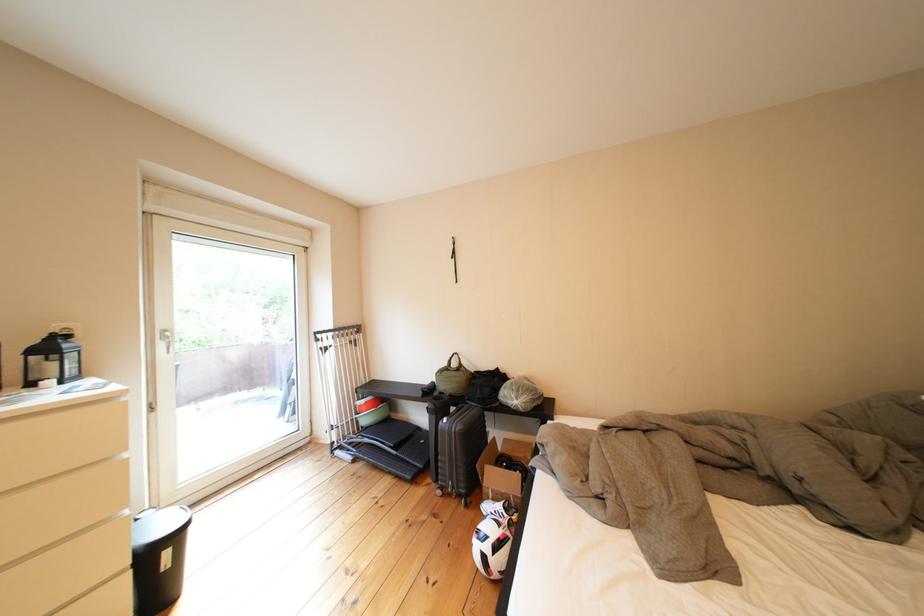
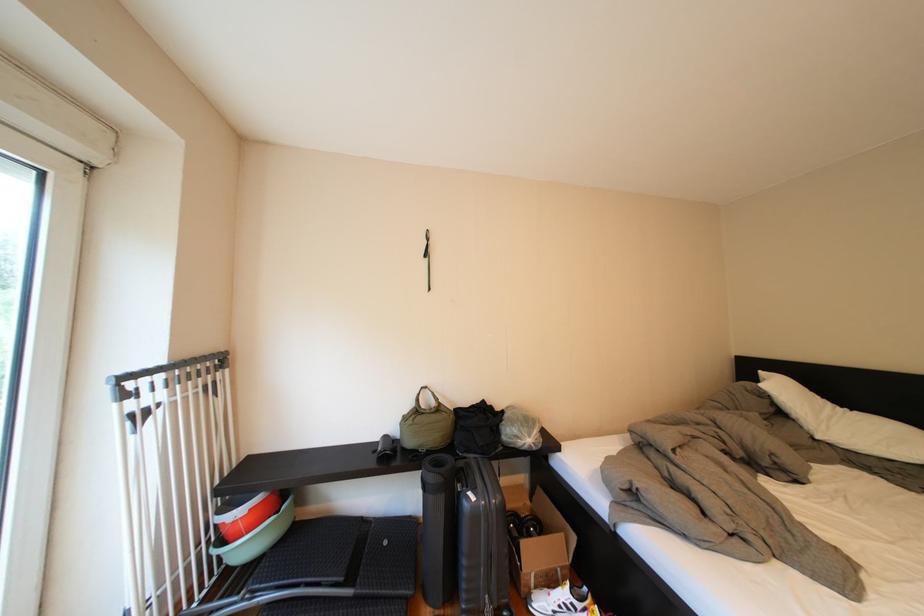
Locate, in the second image, the point that corresponds to pixel 505 480 in the first image.

(544, 557)